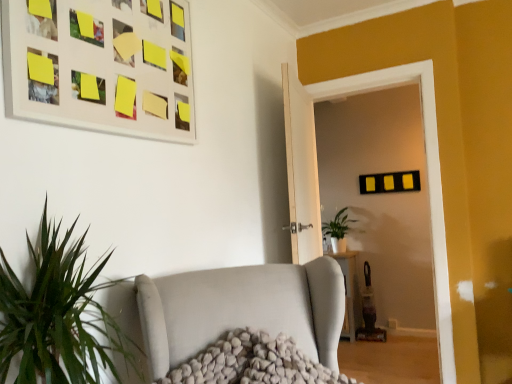
Question: Does green matte plant at center have a greater width compared to matte black glass door at center?

Choices:
 (A) no
 (B) yes

Answer: (B)

Question: Are green matte plant at center and matte black glass door at center far apart?

Choices:
 (A) no
 (B) yes

Answer: (B)

Question: Considering the relative positions of green matte plant at center and matte black glass door at center in the image provided, is green matte plant at center in front of matte black glass door at center?

Choices:
 (A) no
 (B) yes

Answer: (A)

Question: Is green matte plant at center behind matte black glass door at center?

Choices:
 (A) yes
 (B) no

Answer: (A)

Question: Can you confirm if green matte plant at center is smaller than matte black glass door at center?

Choices:
 (A) no
 (B) yes

Answer: (B)

Question: From the image's perspective, is green matte plant at center located above or below matte black glass door at center?

Choices:
 (A) below
 (B) above

Answer: (A)

Question: Which is correct: green matte plant at center is inside matte black glass door at center, or outside of it?

Choices:
 (A) inside
 (B) outside

Answer: (B)

Question: Considering the positions of green matte plant at center and matte black glass door at center in the image, is green matte plant at center bigger or smaller than matte black glass door at center?

Choices:
 (A) big
 (B) small

Answer: (B)

Question: Considering their positions, is green matte plant at center located in front of or behind matte black glass door at center?

Choices:
 (A) front
 (B) behind

Answer: (B)

Question: Is point (326, 233) closer or farther from the camera than point (99, 36)?

Choices:
 (A) farther
 (B) closer

Answer: (A)

Question: Considering the positions of green matte plant at center and matte white picture frame at upper left in the image, is green matte plant at center wider or thinner than matte white picture frame at upper left?

Choices:
 (A) thin
 (B) wide

Answer: (B)

Question: Is green matte plant at center situated inside matte white picture frame at upper left or outside?

Choices:
 (A) inside
 (B) outside

Answer: (B)

Question: Visually, is green matte plant at center positioned to the left or to the right of matte white picture frame at upper left?

Choices:
 (A) left
 (B) right

Answer: (B)

Question: Is matte black glass door at center taller or shorter than green matte plant at center?

Choices:
 (A) short
 (B) tall

Answer: (B)

Question: Would you say matte black glass door at center is inside or outside green matte plant at center?

Choices:
 (A) inside
 (B) outside

Answer: (B)